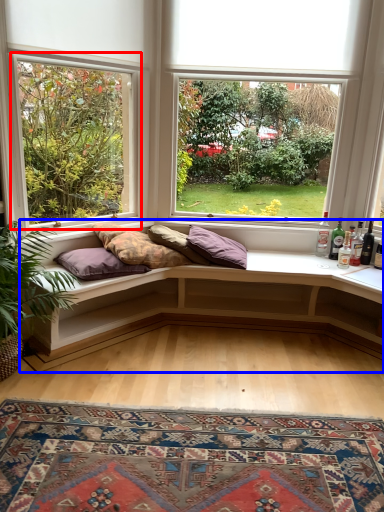
Question: Which of the following is the closest to the observer, window (highlighted by a red box) or studio couch (highlighted by a blue box)?

Choices:
 (A) window
 (B) studio couch

Answer: (A)